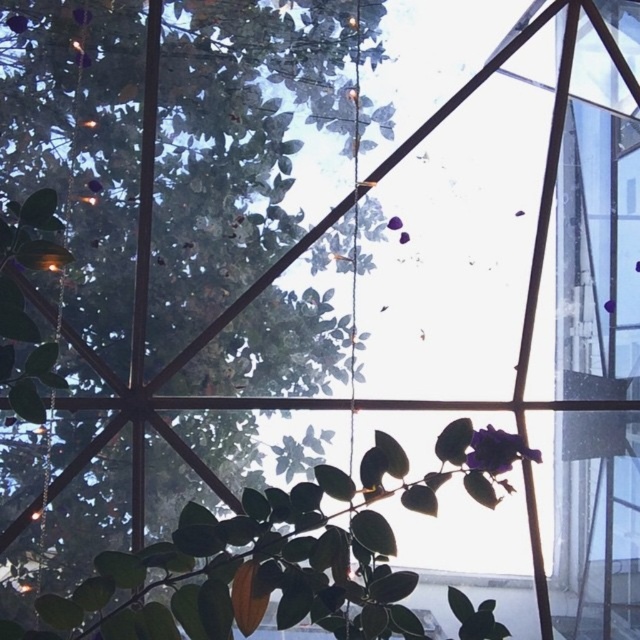
Who is more distant from viewer, (129, 614) or (593, 326)?

Point (593, 326)

Image resolution: width=640 pixels, height=640 pixels. What do you see at coordinates (275, 557) in the screenshot?
I see `green matte leafy plant at lower center` at bounding box center [275, 557].

Is point (132, 563) in front of point (584, 176)?

That is True.

Where is `green matte leafy plant at lower center`? green matte leafy plant at lower center is located at coordinates (275, 557).

Does green leafy tree at center have a lesser width compared to purple matte flower at lower right?

Incorrect, green leafy tree at center's width is not less than purple matte flower at lower right's.

Is point (224, 84) farther from camera compared to point (509, 461)?

Yes, point (224, 84) is behind point (509, 461).

Find the location of a particular element. Image resolution: width=640 pixels, height=640 pixels. green leafy tree at center is located at coordinates (193, 262).

I want to click on transparent glass window at right, so click(596, 237).

Which is above, transparent glass window at right or purple matte flower at lower right?

transparent glass window at right

Identify the location of transparent glass window at right. This screenshot has height=640, width=640. (596, 237).